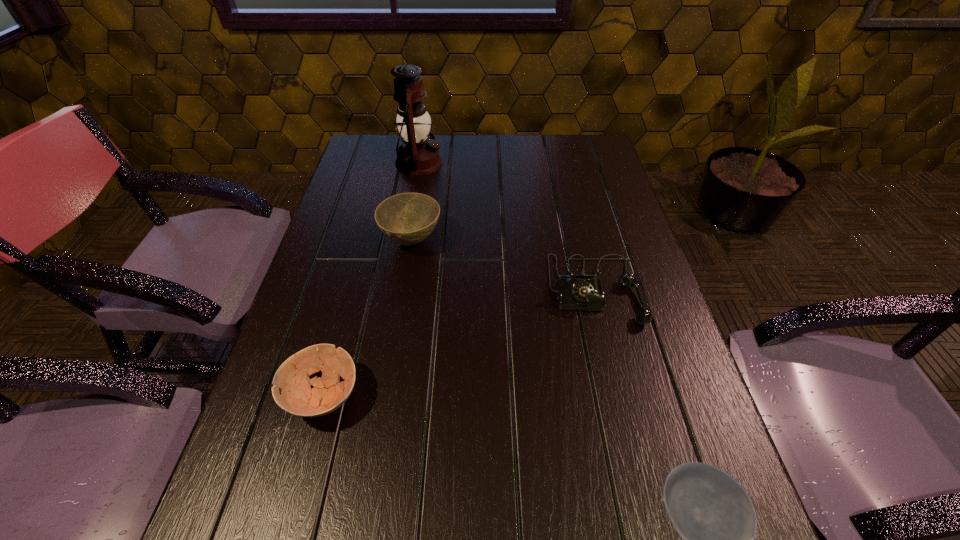
The height and width of the screenshot is (540, 960). I want to click on vacant space that is in between the second farthest bowl and the farthest bowl, so click(368, 318).

Identify the location of the second closest object relative to the farthest object. The image size is (960, 540). (582, 290).

The height and width of the screenshot is (540, 960). I want to click on object that is the second closest to the second nearest bowl, so click(582, 290).

Point out which bowl is positioned as the second nearest to the telephone. Please provide its 2D coordinates. Your answer should be formatted as a tuple, i.e. [(x, y)], where the tuple contains the x and y coordinates of a point satisfying the conditions above.

[(710, 510)]

Select which bowl appears as the second closest to the tallest bowl. Please provide its 2D coordinates. Your answer should be formatted as a tuple, i.e. [(x, y)], where the tuple contains the x and y coordinates of a point satisfying the conditions above.

[(710, 510)]

The height and width of the screenshot is (540, 960). Identify the location of blank area in the image that satisfies the following two spatial constraints: 1. on the back side of the second nearest bowl; 2. on the left side of the farthest bowl. (365, 241).

Find the location of `free space that satisfies the following two spatial constraints: 1. on the side of the farthest bowl, there is a wick adjustment knob; 2. on the right side of the farthest object`. free space that satisfies the following two spatial constraints: 1. on the side of the farthest bowl, there is a wick adjustment knob; 2. on the right side of the farthest object is located at coordinates (405, 241).